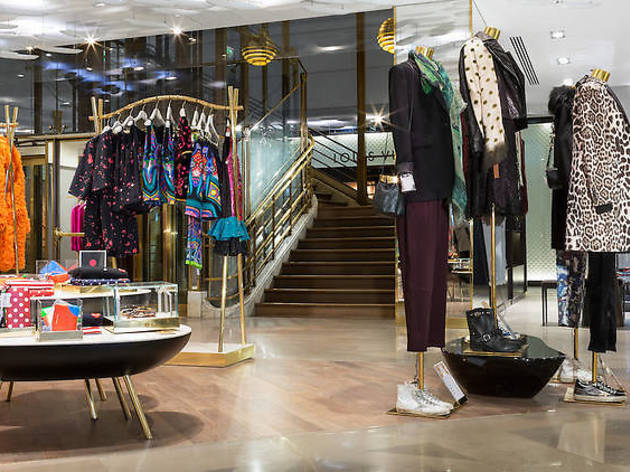
The width and height of the screenshot is (630, 472). I want to click on table, so point(510,369), point(74,345).